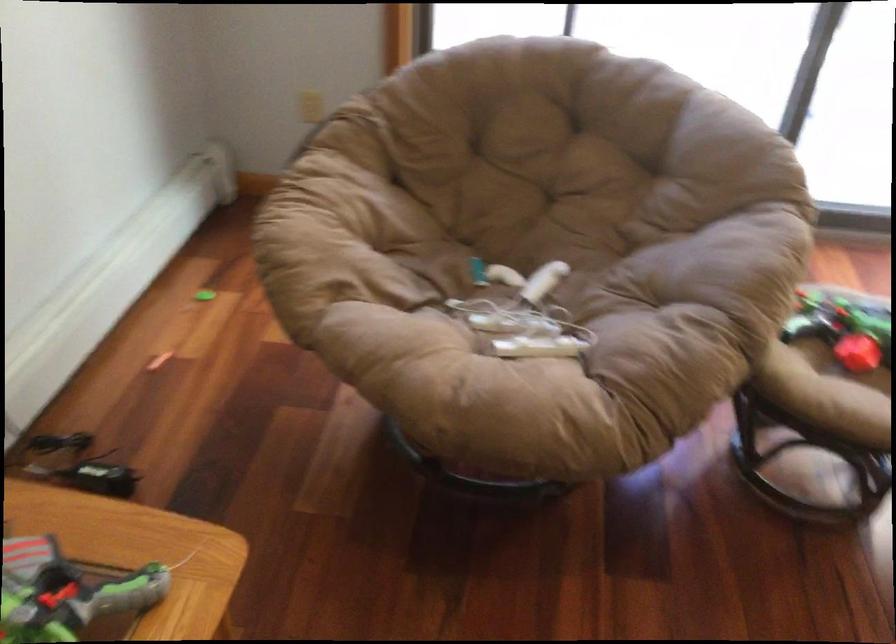
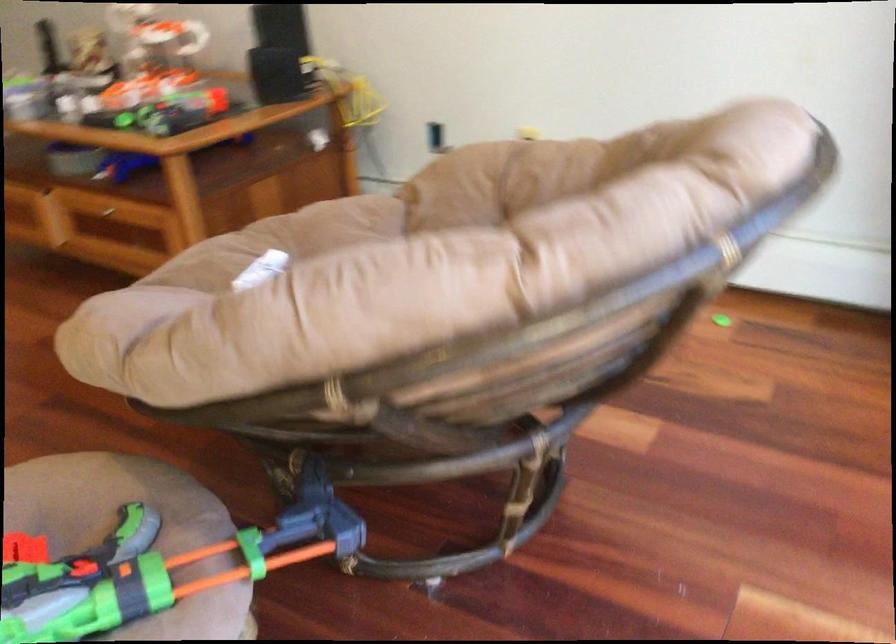
The point at (796, 310) is marked in the first image. Where is the corresponding point in the second image?

(134, 527)